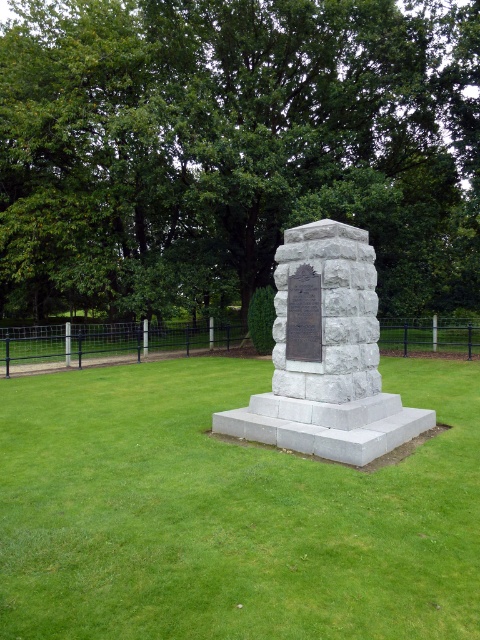
Which of these two, green leafy tree at center or gray stone monument at center, stands taller?

green leafy tree at center is taller.

Who is shorter, green leafy tree at center or gray stone monument at center?

gray stone monument at center is shorter.

From the picture: Who is more distant from viewer, (192, 112) or (360, 330)?

Answer: The point (192, 112) is more distant.

Where is `green leafy tree at center`? This screenshot has width=480, height=640. green leafy tree at center is located at coordinates (232, 150).

Can you confirm if green leafy tree at center is smaller than green grass at center?

No.

The width and height of the screenshot is (480, 640). What do you see at coordinates (232, 150) in the screenshot?
I see `green leafy tree at center` at bounding box center [232, 150].

Identify the location of green leafy tree at center. The image size is (480, 640). (232, 150).

The image size is (480, 640). Find the location of `green leafy tree at center`. green leafy tree at center is located at coordinates (232, 150).

Does point (194, 394) come farther from viewer compared to point (364, 244)?

Yes, point (194, 394) is farther from viewer.

Does green grass at center appear under gray stone monument at center?

Correct, green grass at center is located below gray stone monument at center.

Which is behind, point (336, 528) or point (307, 320)?

Point (307, 320)

I want to click on green grass at center, so click(x=228, y=513).